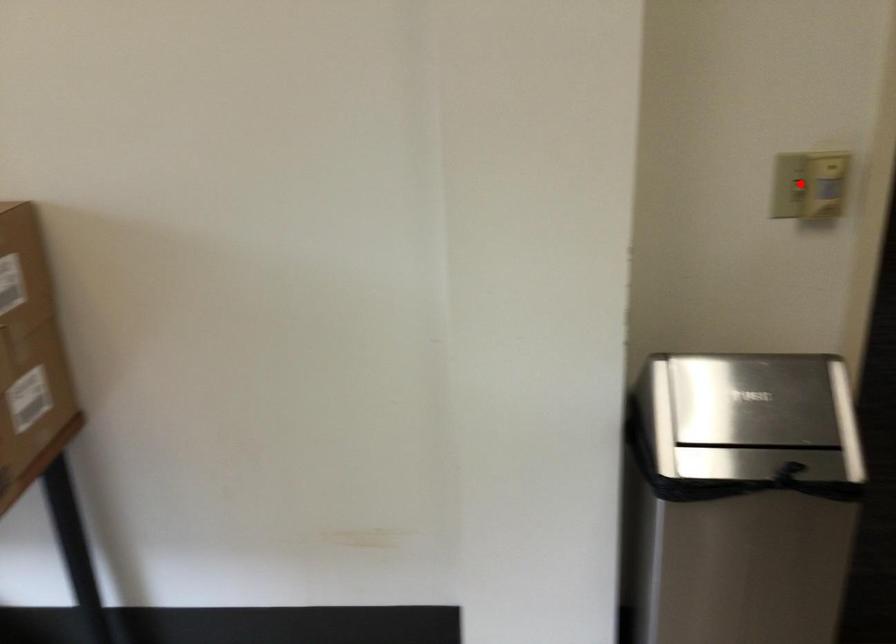
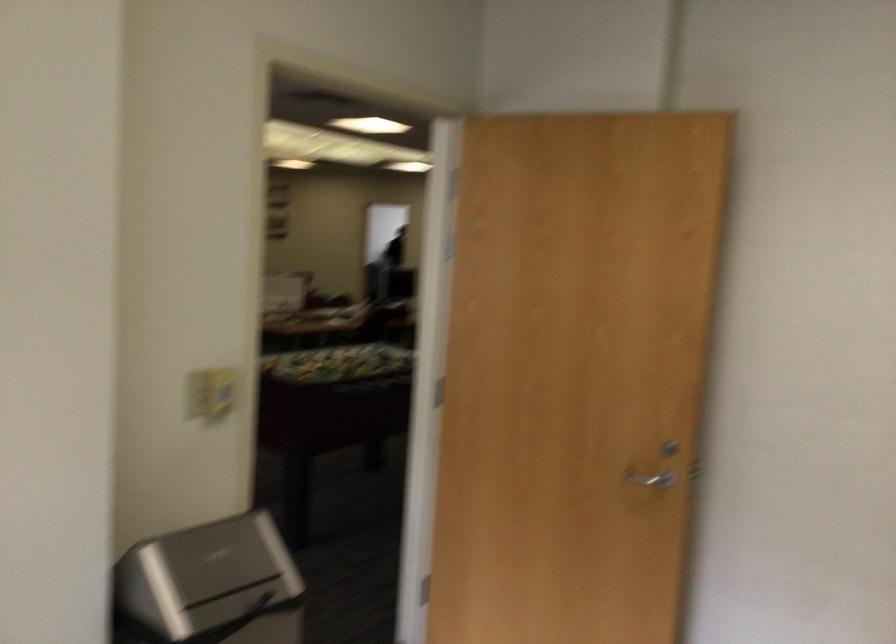
Find the pixel in the second image that matches the highlighted location in the first image.

(209, 393)